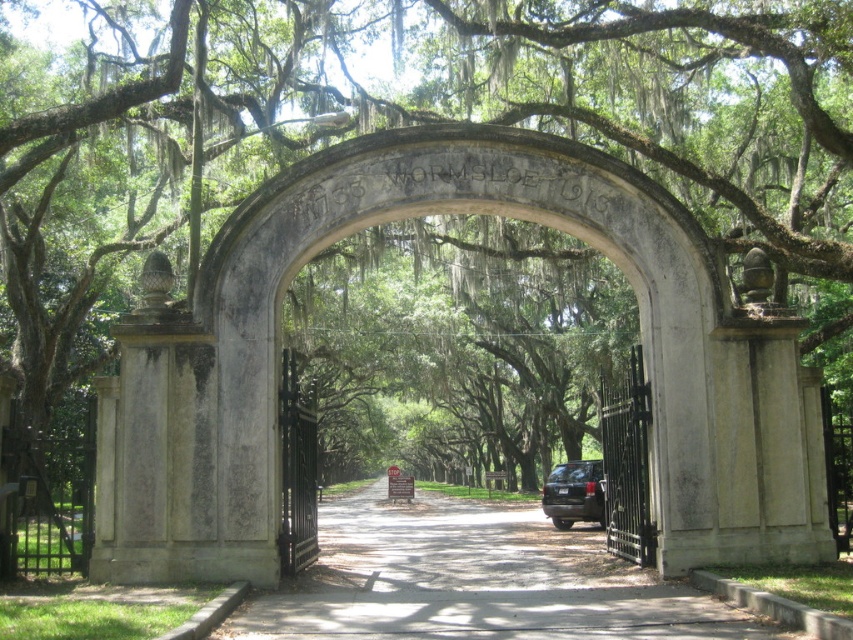
Is smooth asphalt driveway at center positioned behind shiny black suv at center?

No, smooth asphalt driveway at center is in front of shiny black suv at center.

Describe the element at coordinates (474, 580) in the screenshot. The width and height of the screenshot is (853, 640). I see `smooth asphalt driveway at center` at that location.

Locate an element on the screen. smooth asphalt driveway at center is located at coordinates (474, 580).

Find the location of a particular element. Image resolution: width=853 pixels, height=640 pixels. smooth asphalt driveway at center is located at coordinates (474, 580).